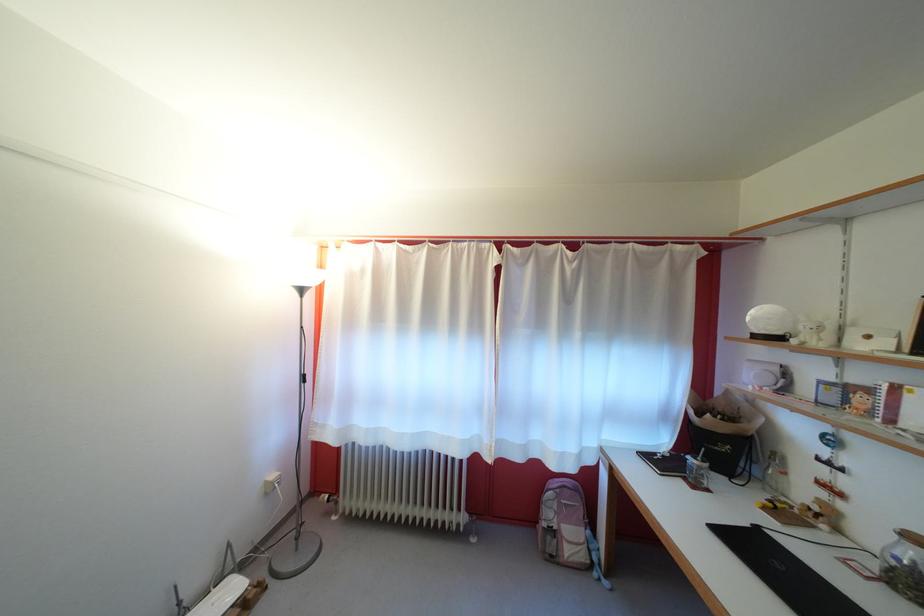
Find the location of a particular element. This screenshot has height=616, width=924. black lamp switch is located at coordinates (302, 378).